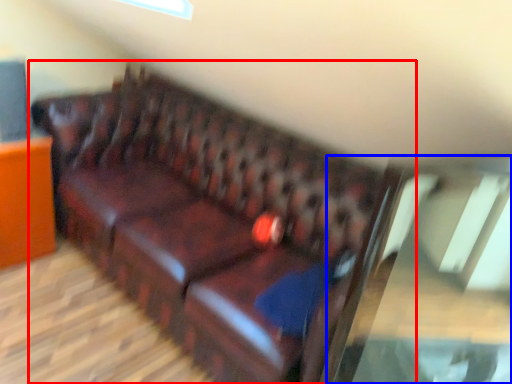
Question: Which of the following is the closest to the observer, studio couch (highlighted by a red box) or glass table (highlighted by a blue box)?

Choices:
 (A) studio couch
 (B) glass table

Answer: (B)